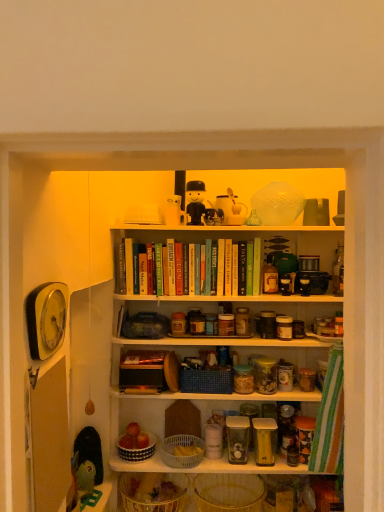
Question: Does clear glass jar at center have a smaller size compared to translucent wicker basket at lower center, which ranks as the 1th basket in bottom-to-top order?

Choices:
 (A) no
 (B) yes

Answer: (B)

Question: Is clear glass jar at center oriented towards translucent wicker basket at lower center, which ranks as the 1th basket in bottom-to-top order?

Choices:
 (A) yes
 (B) no

Answer: (B)

Question: Is clear glass jar at center thinner than translucent wicker basket at lower center, marked as the 5th basket in a top-to-bottom arrangement?

Choices:
 (A) yes
 (B) no

Answer: (A)

Question: From a real-world perspective, is clear glass jar at center on top of translucent wicker basket at lower center, which ranks as the 1th basket in bottom-to-top order?

Choices:
 (A) yes
 (B) no

Answer: (A)

Question: Could translucent wicker basket at lower center, which ranks as the 1th basket in bottom-to-top order, be considered to be inside clear glass jar at center?

Choices:
 (A) yes
 (B) no

Answer: (B)

Question: Looking at their shapes, would you say green plastic toy at lower left, marked as the 2th toy in a left-to-right arrangement, is wider or thinner than black-and-white ceramic bowl at center, the fourth basket when ordered from bottom to top?

Choices:
 (A) wide
 (B) thin

Answer: (B)

Question: Considering their positions, is green plastic toy at lower left, which is the 3th toy in right-to-left order, located in front of or behind black-and-white ceramic bowl at center, which appears as the 2th basket when viewed from the top?

Choices:
 (A) front
 (B) behind

Answer: (A)

Question: From the image's perspective, is green plastic toy at lower left, which is the 3th toy in right-to-left order, positioned above or below black-and-white ceramic bowl at center, which appears as the 2th basket when viewed from the top?

Choices:
 (A) below
 (B) above

Answer: (B)

Question: From a real-world perspective, is green plastic toy at lower left, which is the 3th toy in right-to-left order, physically located above or below black-and-white ceramic bowl at center, which appears as the 2th basket when viewed from the top?

Choices:
 (A) below
 (B) above

Answer: (B)

Question: Is white plastic basket at center, the third basket positioned from the top, taller or shorter than yellow wicker basket at lower center, placed as the second basket when sorted from bottom to top?

Choices:
 (A) tall
 (B) short

Answer: (B)

Question: Considering the positions of white plastic basket at center, the third basket positioned from the top, and yellow wicker basket at lower center, acting as the fourth basket starting from the top, in the image, is white plastic basket at center, the third basket positioned from the top, wider or thinner than yellow wicker basket at lower center, acting as the fourth basket starting from the top,?

Choices:
 (A) thin
 (B) wide

Answer: (A)

Question: Looking at the image, does white plastic basket at center, the third basket when ordered from bottom to top, seem bigger or smaller compared to yellow wicker basket at lower center, acting as the fourth basket starting from the top?

Choices:
 (A) big
 (B) small

Answer: (B)

Question: Considering their positions, is white plastic basket at center, the third basket positioned from the top, located in front of or behind yellow wicker basket at lower center, placed as the second basket when sorted from bottom to top?

Choices:
 (A) behind
 (B) front

Answer: (A)

Question: Is black-and-white ceramic bowl at center, which appears as the 2th basket when viewed from the top, bigger or smaller than yellow wicker basket at lower center, placed as the second basket when sorted from bottom to top?

Choices:
 (A) small
 (B) big

Answer: (A)

Question: Considering the positions of black-and-white ceramic bowl at center, which appears as the 2th basket when viewed from the top, and yellow wicker basket at lower center, placed as the second basket when sorted from bottom to top, in the image, is black-and-white ceramic bowl at center, which appears as the 2th basket when viewed from the top, wider or thinner than yellow wicker basket at lower center, placed as the second basket when sorted from bottom to top,?

Choices:
 (A) wide
 (B) thin

Answer: (B)